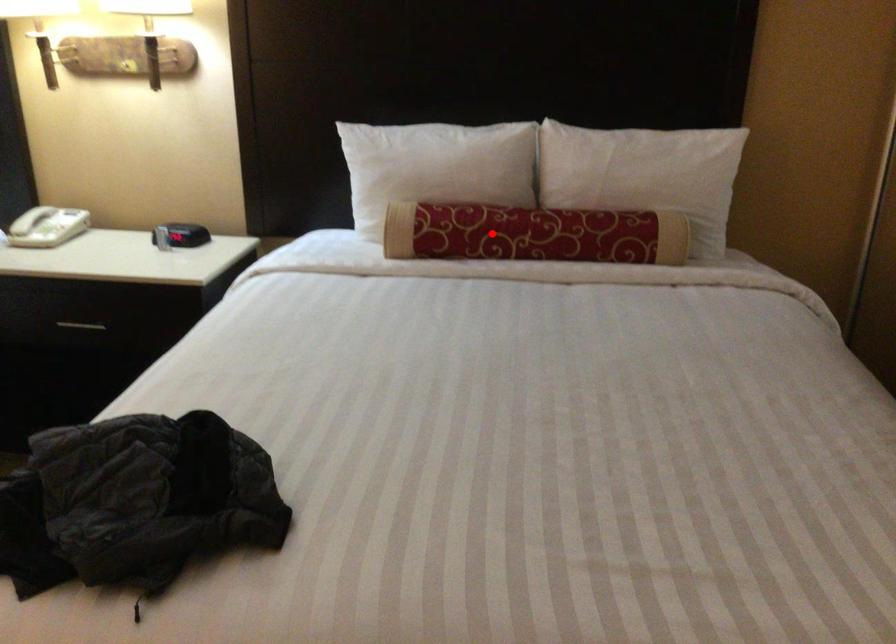
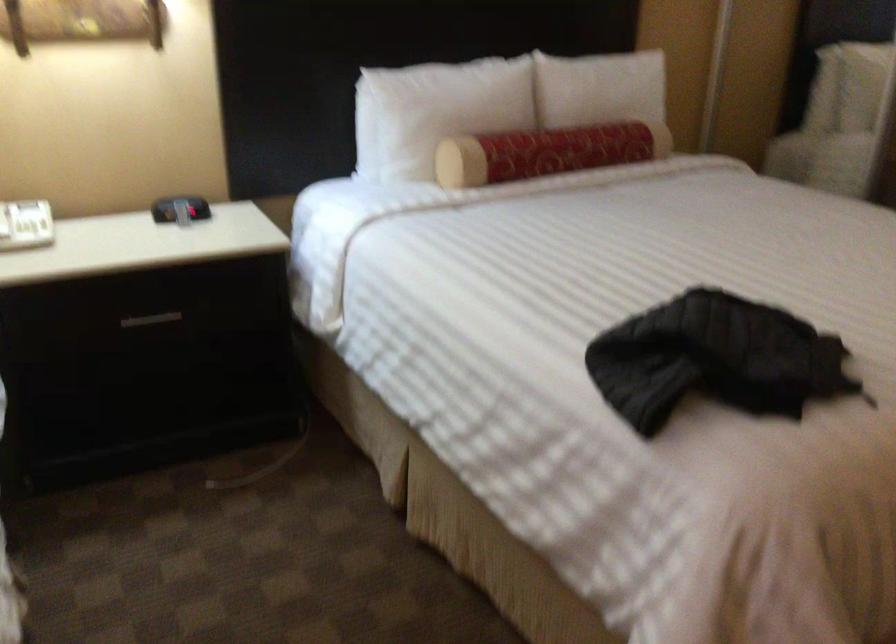
Find the pixel in the second image that matches the highlighted location in the first image.

(546, 152)